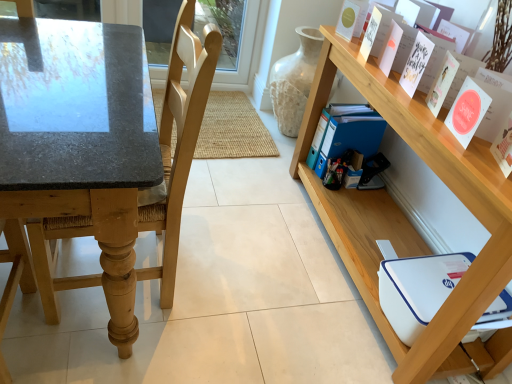
Image resolution: width=512 pixels, height=384 pixels. Find the location of `vacant area that lies between translucent glass vase at upper right and light wood chair at left`. vacant area that lies between translucent glass vase at upper right and light wood chair at left is located at coordinates (233, 183).